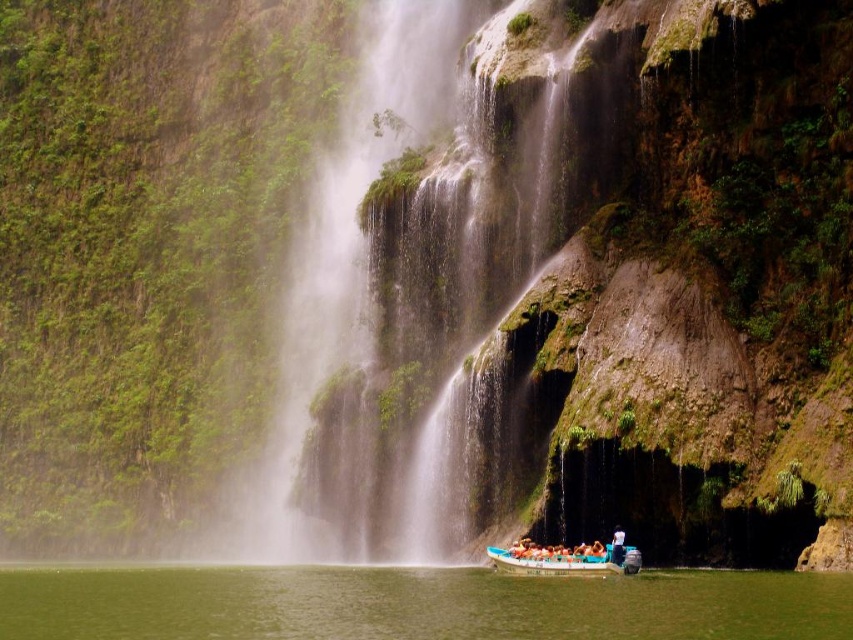
Question: Is green mossy rock at center smaller than white cotton shirt at lower center?

Choices:
 (A) no
 (B) yes

Answer: (A)

Question: Which point is closer to the camera taking this photo?

Choices:
 (A) (503, 561)
 (B) (407, 570)

Answer: (A)

Question: Is green mossy rock at center wider than white cotton shirt at lower center?

Choices:
 (A) no
 (B) yes

Answer: (B)

Question: Which of the following is the farthest from the observer?

Choices:
 (A) blue plastic boat at center
 (B) green mossy rock at center
 (C) white cotton shirt at lower center

Answer: (B)

Question: Estimate the real-world distances between objects in this image. Which object is closer to the white cotton shirt at lower center?

Choices:
 (A) blue plastic boat at center
 (B) green mossy rock at center

Answer: (A)

Question: Does green mossy rock at center have a larger size compared to white cotton shirt at lower center?

Choices:
 (A) yes
 (B) no

Answer: (A)